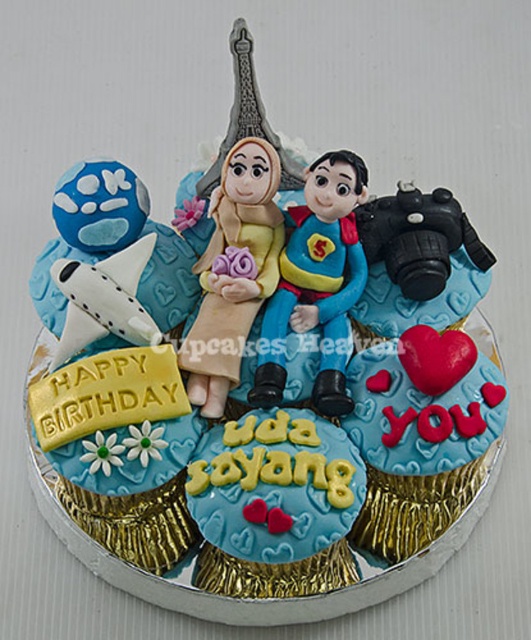
Question: Considering the relative positions of matte plastic couple at center and matte yellow fabric doll at center in the image provided, where is matte plastic couple at center located with respect to matte yellow fabric doll at center?

Choices:
 (A) below
 (B) above

Answer: (A)

Question: Among these objects, which one is farthest from the camera?

Choices:
 (A) matte blue airplane at left
 (B) matte plastic couple at center
 (C) matte yellow fabric doll at center

Answer: (A)

Question: Which object is the closest to the matte plastic couple at center?

Choices:
 (A) matte blue airplane at left
 (B) matte yellow fabric doll at center

Answer: (B)

Question: Can you confirm if matte plastic couple at center is smaller than matte yellow fabric doll at center?

Choices:
 (A) yes
 (B) no

Answer: (B)

Question: Does matte plastic couple at center have a greater width compared to matte blue airplane at left?

Choices:
 (A) no
 (B) yes

Answer: (A)

Question: Based on their relative distances, which object is farther from the matte blue airplane at left?

Choices:
 (A) matte yellow fabric doll at center
 (B) matte plastic couple at center

Answer: (B)